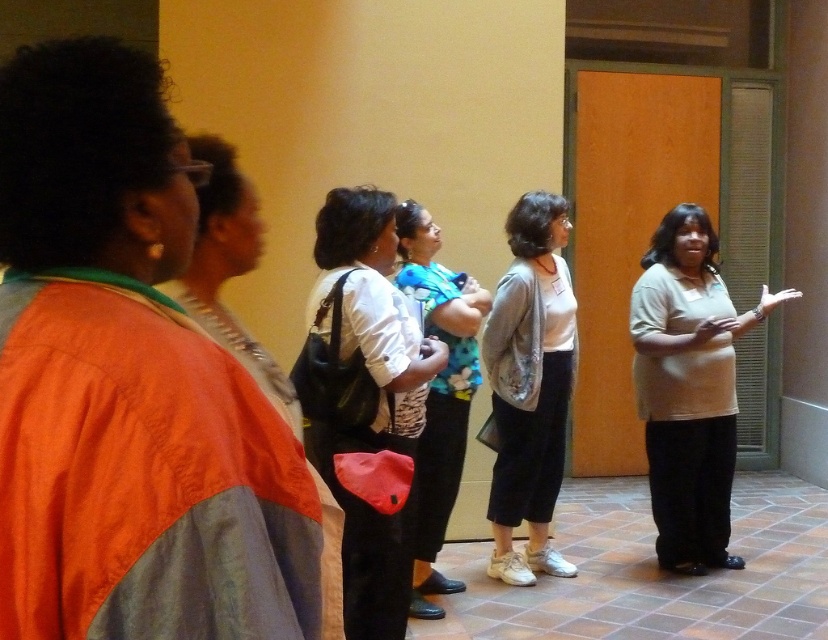
Between beige matte shirt at center and floral fabric blouse at center, which one appears on the right side from the viewer's perspective?

beige matte shirt at center is more to the right.

Is point (677, 440) farther from camera compared to point (443, 451)?

Yes, point (677, 440) is farther from viewer.

I want to click on beige matte shirt at center, so click(689, 387).

Which is behind, point (496, 508) or point (436, 573)?

The point (496, 508) is more distant.

Between point (499, 512) and point (473, 317), which one is positioned in front?

Point (473, 317) is more forward.

Find the location of a particular element. gray sweater at center is located at coordinates (530, 385).

The height and width of the screenshot is (640, 828). Describe the element at coordinates (364, 401) in the screenshot. I see `white fabric shirt at center` at that location.

Where is `white fabric shirt at center`? The width and height of the screenshot is (828, 640). white fabric shirt at center is located at coordinates (364, 401).

I want to click on white fabric shirt at center, so click(x=364, y=401).